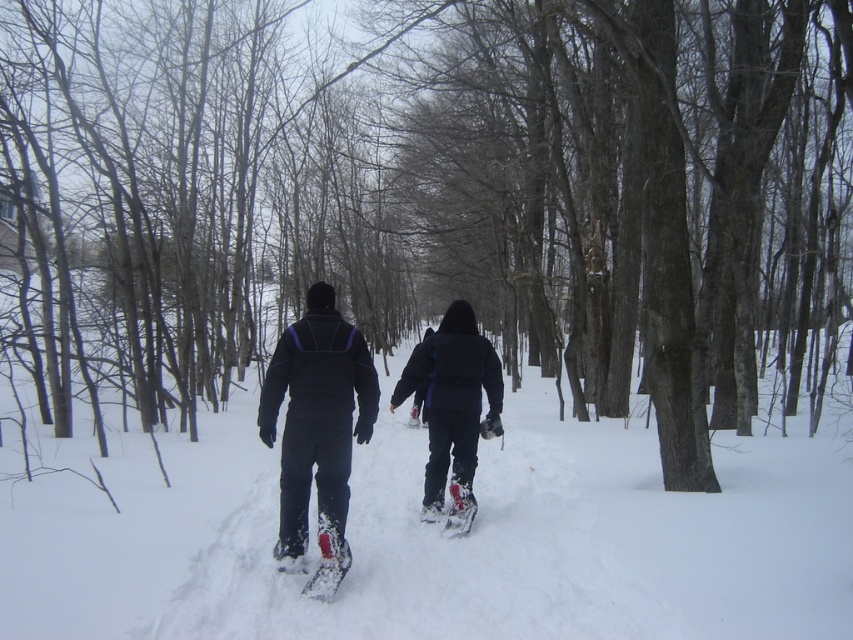
Question: Is white fluffy snow at center bigger than dark blue snowsuit at center?

Choices:
 (A) no
 (B) yes

Answer: (B)

Question: Is dark blue snowsuit at center above red plastic ski at lower center?

Choices:
 (A) yes
 (B) no

Answer: (A)

Question: Among these objects, which one is farthest from the camera?

Choices:
 (A) dark blue snowsuit at center
 (B) white rubber snowshoe at center
 (C) white fluffy snow at center
 (D) white plastic snowshoe at center

Answer: (A)

Question: Observing the image, what is the correct spatial positioning of black matte snowshoes at center in reference to white plastic snowshoe at center?

Choices:
 (A) above
 (B) below

Answer: (A)

Question: Which object appears farthest from the camera in this image?

Choices:
 (A) matte black snowsuit at center
 (B) white fluffy snow at center
 (C) white rubber snowshoe at center
 (D) white rubber snowshoe at lower center

Answer: (D)

Question: Which point is farther from the camera taking this photo?

Choices:
 (A) (451, 483)
 (B) (427, 509)
 (C) (437, 333)
 (D) (321, 516)

Answer: (B)